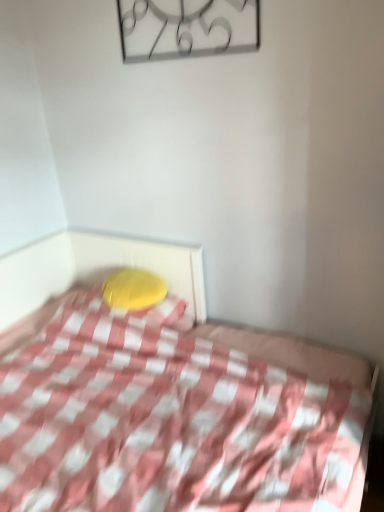
Question: Looking at their shapes, would you say metallic clock at upper center is wider or thinner than pink checkered fabric at center?

Choices:
 (A) thin
 (B) wide

Answer: (A)

Question: Considering their positions, is metallic clock at upper center located in front of or behind pink checkered fabric at center?

Choices:
 (A) front
 (B) behind

Answer: (B)

Question: Estimate the real-world distances between objects in this image. Which object is farther from the metallic clock at upper center?

Choices:
 (A) yellow fabric pillow at center
 (B) pink checkered fabric at center

Answer: (B)

Question: Estimate the real-world distances between objects in this image. Which object is farther from the metallic clock at upper center?

Choices:
 (A) yellow fabric pillow at center
 (B) pink checkered fabric at center

Answer: (B)